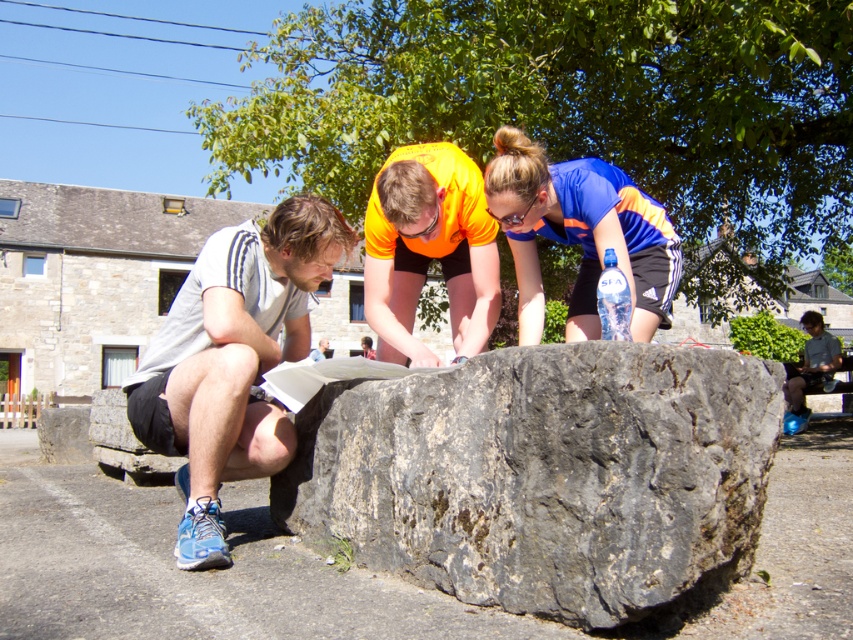
Image resolution: width=853 pixels, height=640 pixels. Describe the element at coordinates (231, 360) in the screenshot. I see `white matte t-shirt at left` at that location.

Is white matte t-shirt at left thinner than blue jersey at center?

In fact, white matte t-shirt at left might be wider than blue jersey at center.

Is point (265, 355) behind point (585, 214)?

No.

Where is `white matte t-shirt at left`? This screenshot has height=640, width=853. white matte t-shirt at left is located at coordinates pos(231,360).

Which is more to the right, blue jersey at center or dark gray stone bench at lower right?

Positioned to the right is dark gray stone bench at lower right.

Is blue jersey at center closer to the viewer compared to dark gray stone bench at lower right?

No, blue jersey at center is behind dark gray stone bench at lower right.

Which is behind, point (517, 266) or point (816, 333)?

The point (816, 333) is behind.

Where is `blue jersey at center`? The width and height of the screenshot is (853, 640). blue jersey at center is located at coordinates (579, 234).

From the picture: Who is taller, orange fabric shirt at center or transparent plastic bottle at center?

With more height is orange fabric shirt at center.

Can you confirm if orange fabric shirt at center is positioned to the left of transparent plastic bottle at center?

Yes, orange fabric shirt at center is to the left of transparent plastic bottle at center.

Is point (381, 259) farther from viewer compared to point (601, 301)?

That is True.

Identify the location of orange fabric shirt at center. The height and width of the screenshot is (640, 853). (430, 252).